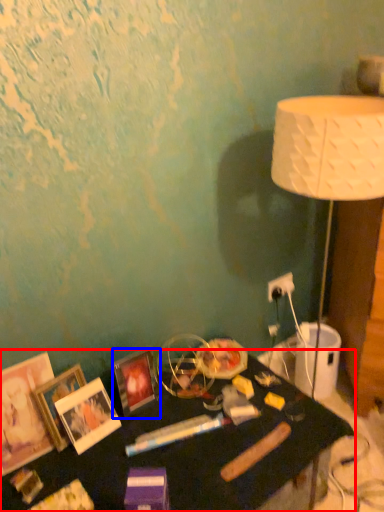
Question: Which of the following is the farthest to the observer, table (highlighted by a red box) or picture frame (highlighted by a blue box)?

Choices:
 (A) table
 (B) picture frame

Answer: (B)